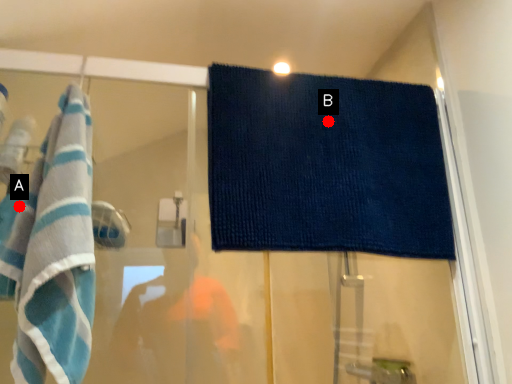
Question: Two points are circled on the image, labeled by A and B beside each circle. Which of the following is the farthest from the observer?

Choices:
 (A) A is further
 (B) B is further

Answer: (B)